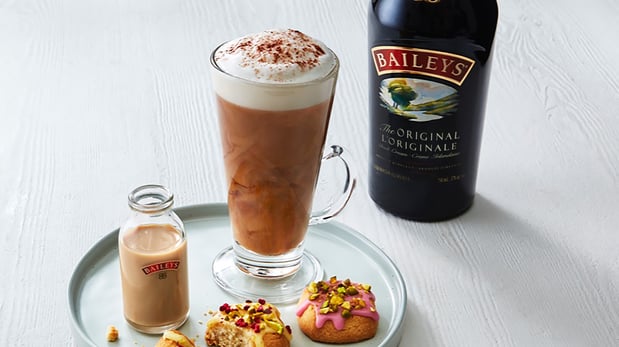
Identify the location of wood table top. (509, 284).